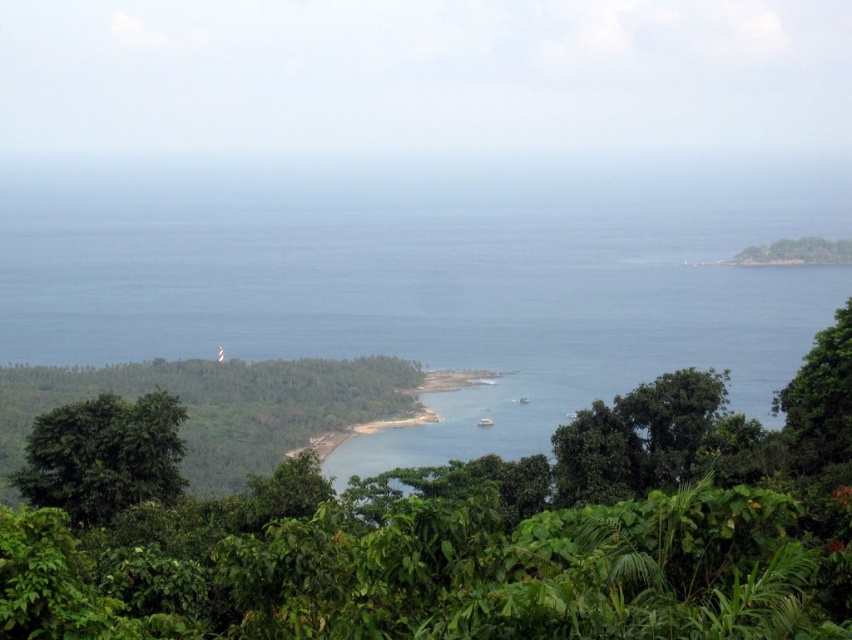
You are standing at the camera position looking at the coastal landscape. There is a specific point marked at coordinates point [352,586]. If you want to place a buoy exactly at that point in the water, how far in feet would you need to travel from your current position to reach it?

The point [352,586] is 51.45 feet from the camera, so you would need to travel 51.45 feet to reach it.